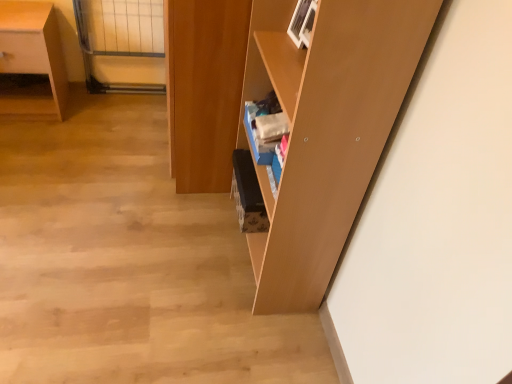
You are a GUI agent. You are given a task and a screenshot of the screen. Output one action in this format:
    pyautogui.click(x=<x>, y=<y>)
    Task: Click on the vacant area situated to the left side of matte wood shelf at center
    
    Given the screenshot: What is the action you would take?
    pyautogui.click(x=175, y=241)